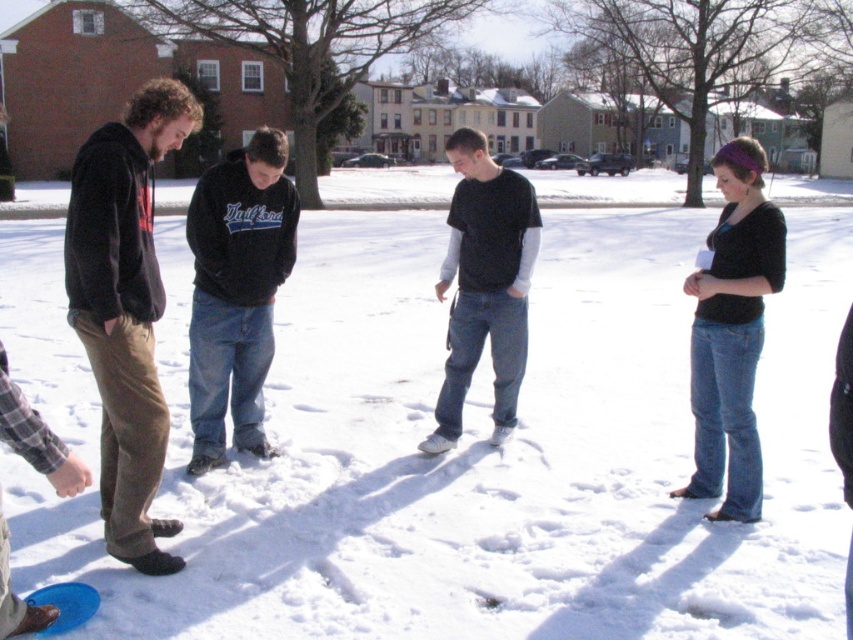
Does denim jeans at right appear over black cotton shirt at center?

No.

Is point (746, 342) less distant than point (457, 326)?

Yes, point (746, 342) is closer to viewer.

What do you see at coordinates (732, 332) in the screenshot? I see `denim jeans at right` at bounding box center [732, 332].

At what (x,y) coordinates should I click in order to perform the action: click on denim jeans at right. Please return your answer as a coordinate pair (x, y). Looking at the image, I should click on (732, 332).

Does dark brown corduroy pants at left have a smaller size compared to black cotton shirt at center?

Incorrect, dark brown corduroy pants at left is not smaller in size than black cotton shirt at center.

Which is in front, point (114, 413) or point (448, 392)?

Positioned in front is point (114, 413).

Between point (91, 234) and point (512, 273), which one is positioned in front?

Point (91, 234)

The image size is (853, 640). In order to click on dark brown corduroy pants at left in this screenshot , I will do `click(125, 308)`.

Looking at this image, is black cotton hoodie at center further to the viewer compared to denim jeans at right?

That is True.

Is black cotton hoodie at center shorter than denim jeans at right?

Yes, black cotton hoodie at center is shorter than denim jeans at right.

Which is in front, point (224, 160) or point (730, 234)?

Point (730, 234) is in front.

Identify the location of black cotton hoodie at center. The width and height of the screenshot is (853, 640). (236, 291).